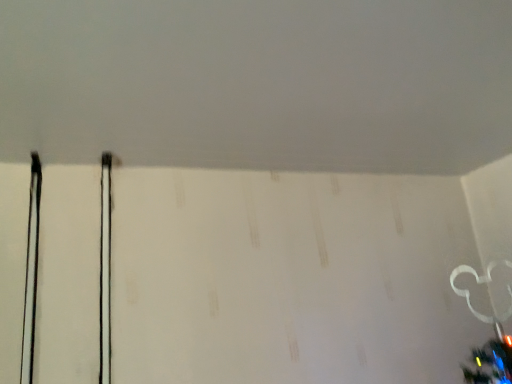
At what (x,y) coordinates should I click in order to perform the action: click on white matte wall at upper center. Please return your answer as a coordinate pair (x, y). The image size is (512, 384). Looking at the image, I should click on (259, 83).

This screenshot has height=384, width=512. What do you see at coordinates (259, 83) in the screenshot? I see `white matte wall at upper center` at bounding box center [259, 83].

In order to face white matte wall at upper center, should I rotate leftwards or rightwards?

To align with it, rotate right about 10.672°.

This screenshot has height=384, width=512. In order to click on white matte wall at upper center in this screenshot , I will do (x=259, y=83).